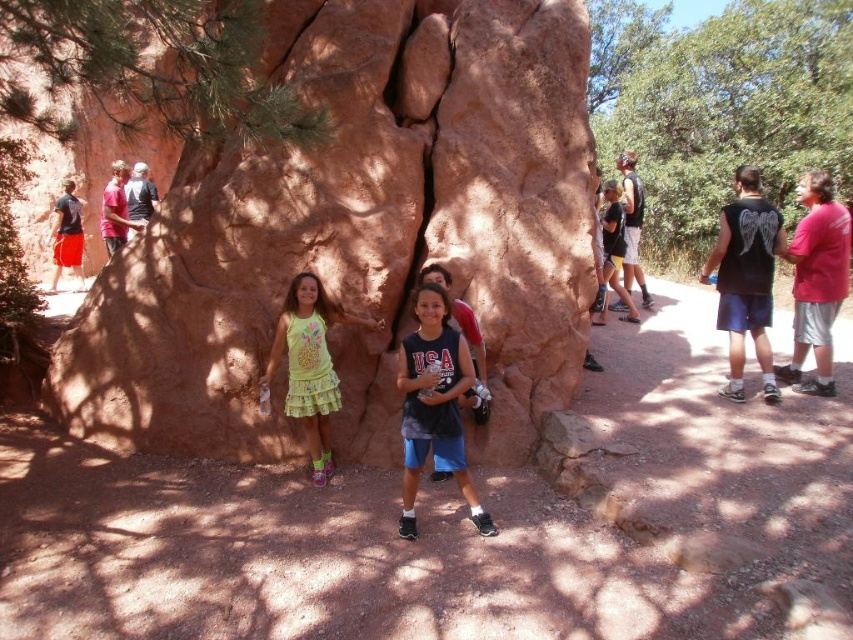
You are standing at the point marked as point (434, 404) in the image. Looking around, you see the three children. Which child is directly in front of you?

The point (434, 404) corresponds to the dark blue t shirt at center, so the child in the middle wearing the dark blue T shirt with USA printed on it is directly in front of you.

You are standing at point (108, 246) and want to move to the large reddish brown rock formation. Is the point (625, 280) between you and the rock formation?

Yes, point (625, 280) is between you and the rock formation because it is in front of point (108, 246).